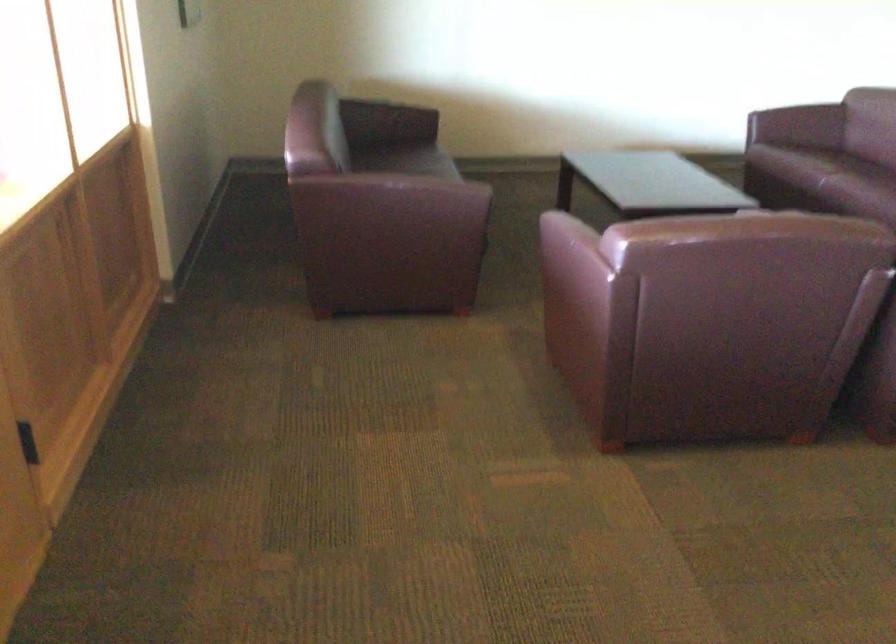
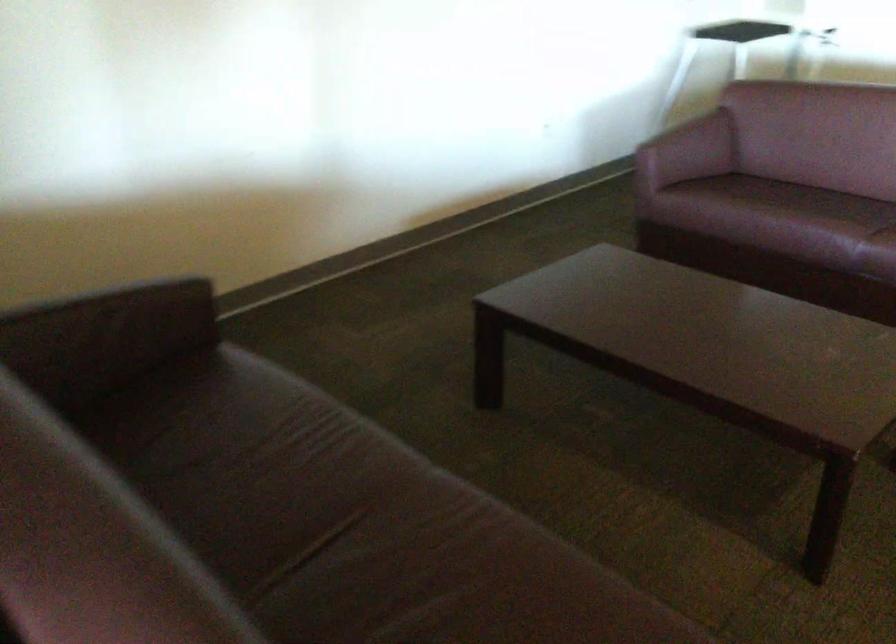
The first image is from the beginning of the video and the second image is from the end. How did the camera likely rotate when shooting the video?

The camera's rotation is toward right-down.